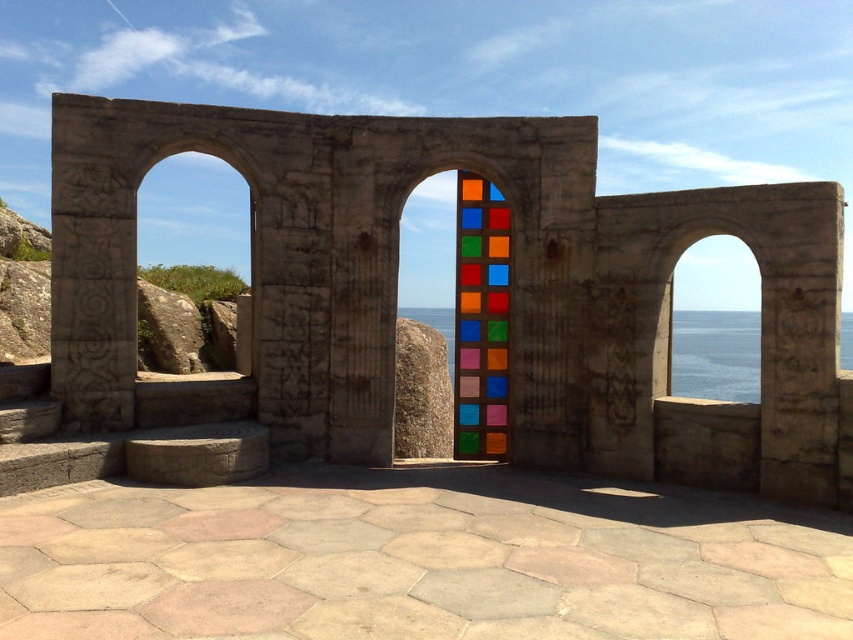
Question: Which object is farther from the camera taking this photo?

Choices:
 (A) multicolored glass door at center
 (B) stained glass window at center
 (C) blue glass water at right

Answer: (B)

Question: Which point is closer to the camera?

Choices:
 (A) (605, 308)
 (B) (474, 221)
 (C) (732, 371)
 (D) (700, 333)

Answer: (A)

Question: In this image, where is multicolored glass door at center located relative to transparent glass water at center?

Choices:
 (A) right
 (B) left

Answer: (B)

Question: Can you confirm if multicolored glass door at center is positioned to the left of transparent glass water at center?

Choices:
 (A) yes
 (B) no

Answer: (A)

Question: Which object appears closest to the camera in this image?

Choices:
 (A) stained glass window at center
 (B) transparent glass water at center
 (C) multicolored glass door at center

Answer: (B)

Question: Considering the relative positions of multicolored glass door at center and transparent glass water at center in the image provided, where is multicolored glass door at center located with respect to transparent glass water at center?

Choices:
 (A) right
 (B) left

Answer: (B)